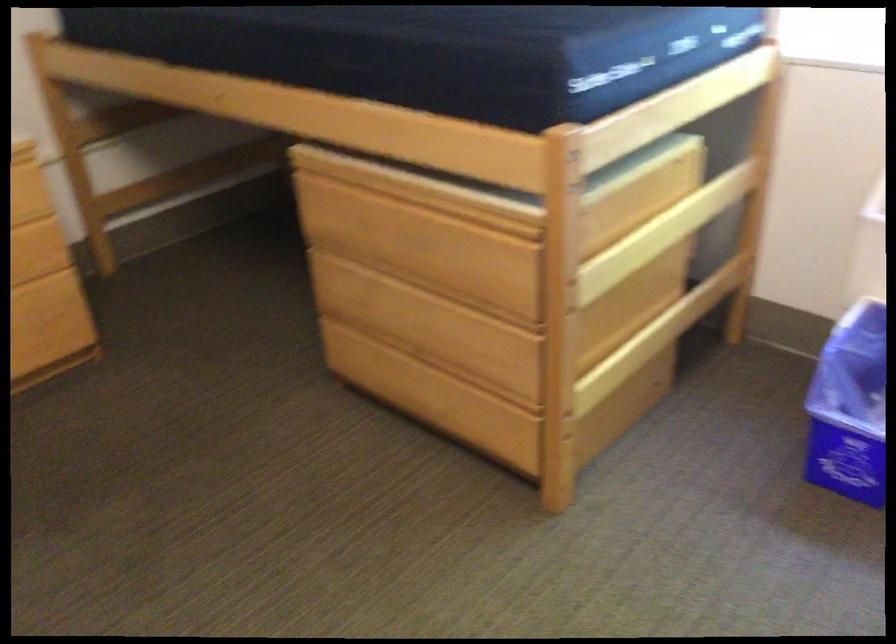
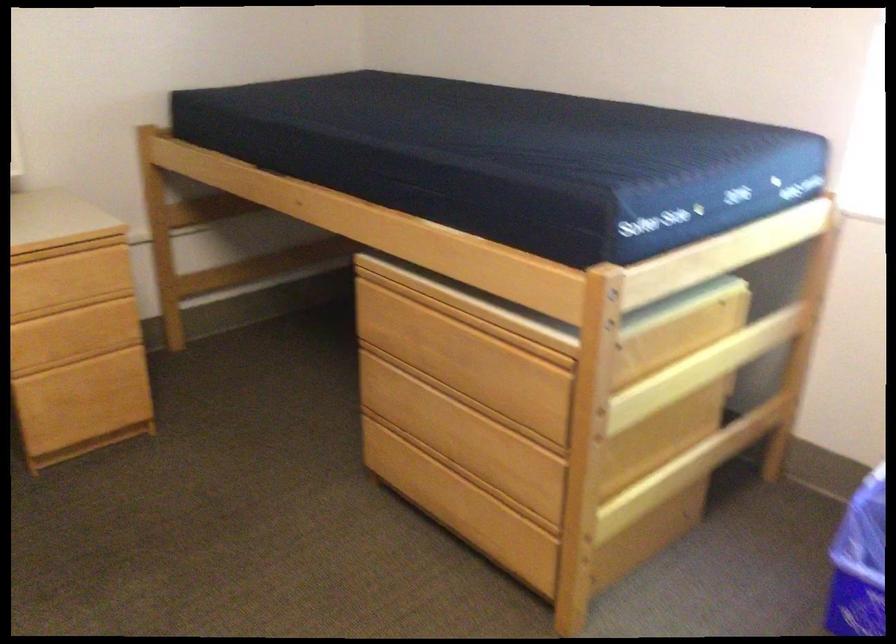
The point at (403, 377) is marked in the first image. Where is the corresponding point in the second image?

(434, 483)